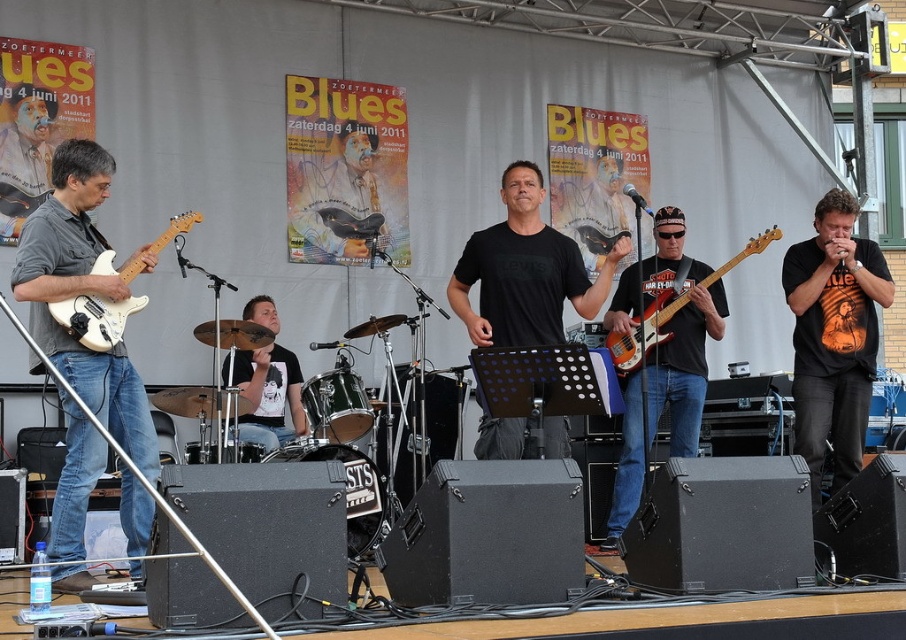
Looking at this image, in the image of the band performance, where exactly is the matte white guitar at left located in terms of coordinates?

The matte white guitar at left is located at coordinates point (74, 339).